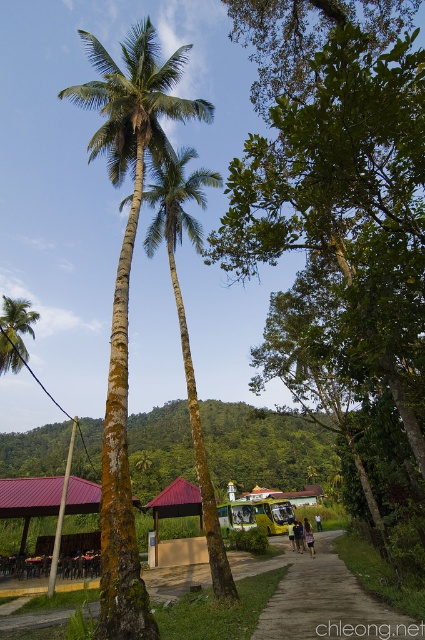
Is brown dirt path at center shorter than green bark palm trees at center?

Yes.

Can you confirm if brown dirt path at center is taller than green bark palm trees at center?

In fact, brown dirt path at center may be shorter than green bark palm trees at center.

The height and width of the screenshot is (640, 425). I want to click on brown dirt path at center, so click(x=328, y=602).

Is point (119, 557) closer to viewer compared to point (150, 250)?

Yes, point (119, 557) is in front of point (150, 250).

The height and width of the screenshot is (640, 425). What do you see at coordinates (127, 291) in the screenshot?
I see `green rough bark coconut tree at center` at bounding box center [127, 291].

Where is `green rough bark coconut tree at center`? green rough bark coconut tree at center is located at coordinates (127, 291).

Does brown wooden hut at center have a greater width compared to green leafy palm tree at upper left?

No.

You are a GUI agent. You are given a task and a screenshot of the screen. Output one action in this format:
    pyautogui.click(x=<x>, y=<y>)
    Task: Click on the brown wooden hut at center
    
    Given the screenshot: What is the action you would take?
    pyautogui.click(x=176, y=516)

Does point (180, 509) come behind point (11, 323)?

No, it is in front of (11, 323).

Find the location of a particular element. The width and height of the screenshot is (425, 640). brown wooden hut at center is located at coordinates (176, 516).